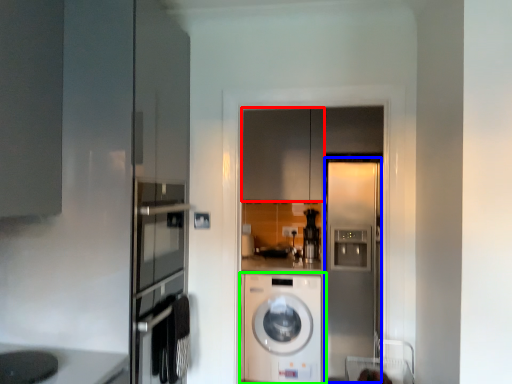
Question: Which object is the farthest from cabinetry (highlighted by a red box)? Choose among these: screen door (highlighted by a blue box) or washing machine (highlighted by a green box).

Choices:
 (A) screen door
 (B) washing machine

Answer: (B)